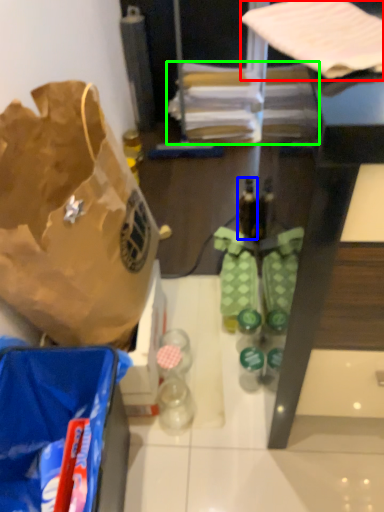
Question: Which is farther away from wrapping paper (highlighted by a red box)? bottle (highlighted by a blue box) or wrapping paper (highlighted by a green box)?

Choices:
 (A) bottle
 (B) wrapping paper

Answer: (B)